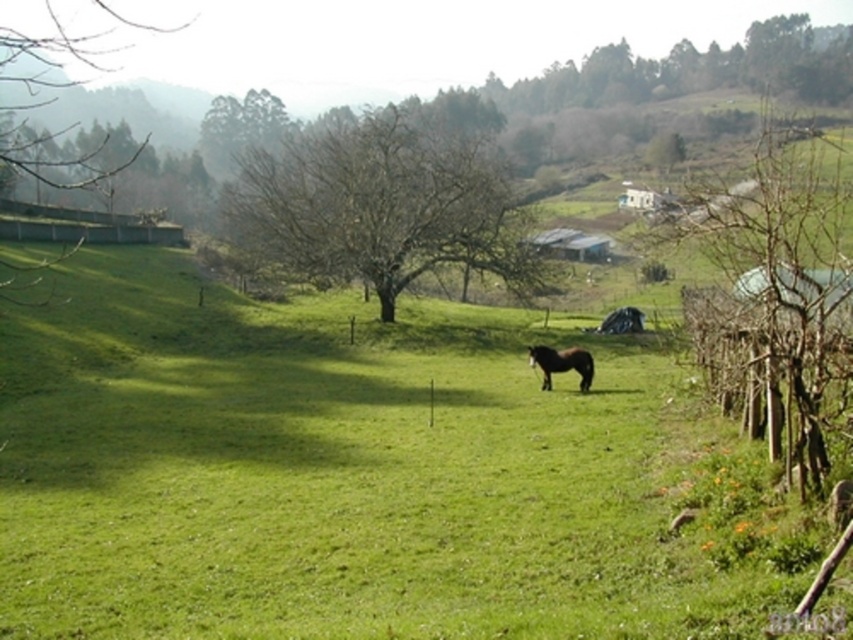
Does bare wood tree at right have a greater height compared to brown glossy horse at center?

Yes, bare wood tree at right is taller than brown glossy horse at center.

Does bare wood tree at right have a lesser height compared to brown glossy horse at center?

Incorrect, bare wood tree at right's height does not fall short of brown glossy horse at center's.

What do you see at coordinates (778, 298) in the screenshot? The image size is (853, 640). I see `bare wood tree at right` at bounding box center [778, 298].

Identify the location of bare wood tree at right. (778, 298).

Can you confirm if bare wood tree at center is thinner than brown glossy horse at center?

No.

Locate an element on the screen. The height and width of the screenshot is (640, 853). bare wood tree at center is located at coordinates point(383,205).

Which is above, bare wood tree at right or bare wood tree at center?

bare wood tree at right

Is point (778, 186) positioned after point (349, 150)?

That is False.

Find the location of `bare wood tree at right`. bare wood tree at right is located at coordinates (778, 298).